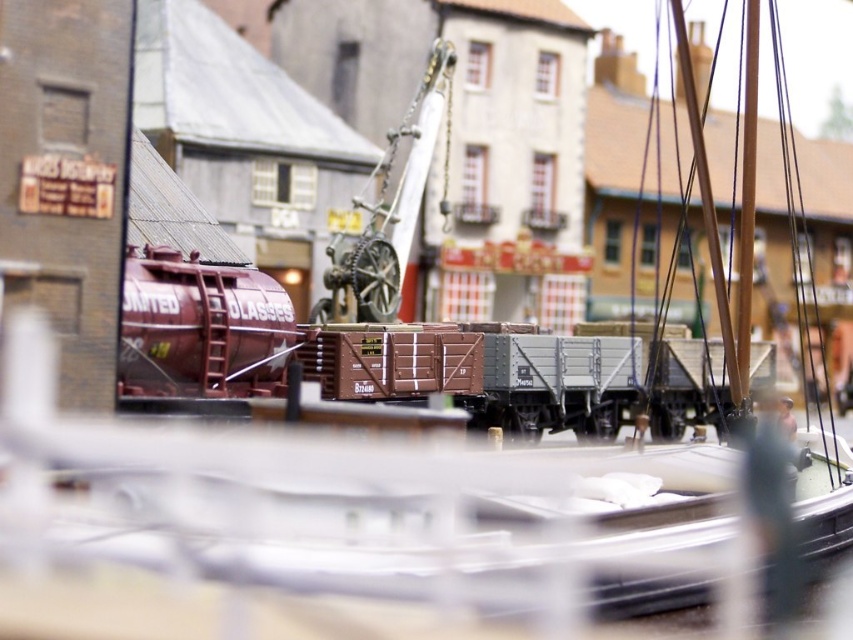
You are a model train enthusiast who wants to place a new miniature figure between the maroon metallic tank car at center and the metallic gray crane at center. Based on their positions, which object should the figure be closer to if it needs to be placed directly in front of the crane?

The maroon metallic tank car at center is located below the metallic gray crane at center, so placing the figure directly in front of the crane would require positioning it closer to the metallic gray crane at center.

You are a model train enthusiast examining the diorama. You notice a specific point at coordinates (x=248, y=337). What object is located at that coordinate?

The point at coordinates (x=248, y=337) corresponds to the maroon metallic tank car at center.